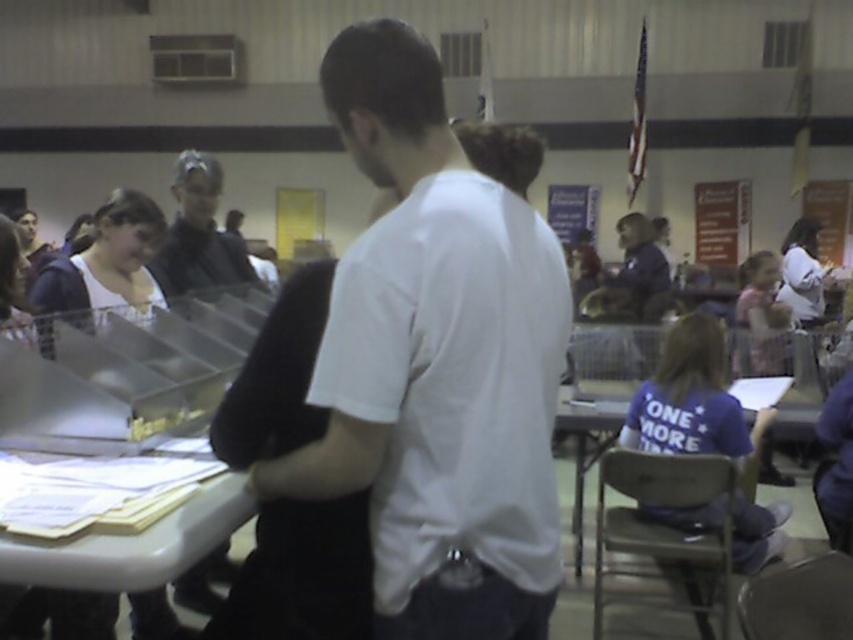
Is point (218, 253) positioned in front of point (621, 234)?

Yes.

The width and height of the screenshot is (853, 640). I want to click on matte black shirt at upper left, so click(199, 234).

Find the location of a particular element. This screenshot has height=640, width=853. matte black shirt at upper left is located at coordinates (199, 234).

Between point (245, 268) and point (784, 408), which one is positioned in front?

Positioned in front is point (784, 408).

Who is positioned more to the left, matte black shirt at upper left or wooden table at lower right?

matte black shirt at upper left is more to the left.

Between point (177, 198) and point (563, 390), which one is positioned in front?

Positioned in front is point (177, 198).

Where is `matte black shirt at upper left`? This screenshot has width=853, height=640. matte black shirt at upper left is located at coordinates (x=199, y=234).

Is white matte shirt at center smaller than matte black shirt at upper left?

Yes.

Who is lower down, white matte shirt at center or matte black shirt at upper left?

white matte shirt at center

Who is more forward, (407, 464) or (193, 196)?

Point (407, 464)

This screenshot has height=640, width=853. Identify the location of white matte shirt at center. (436, 364).